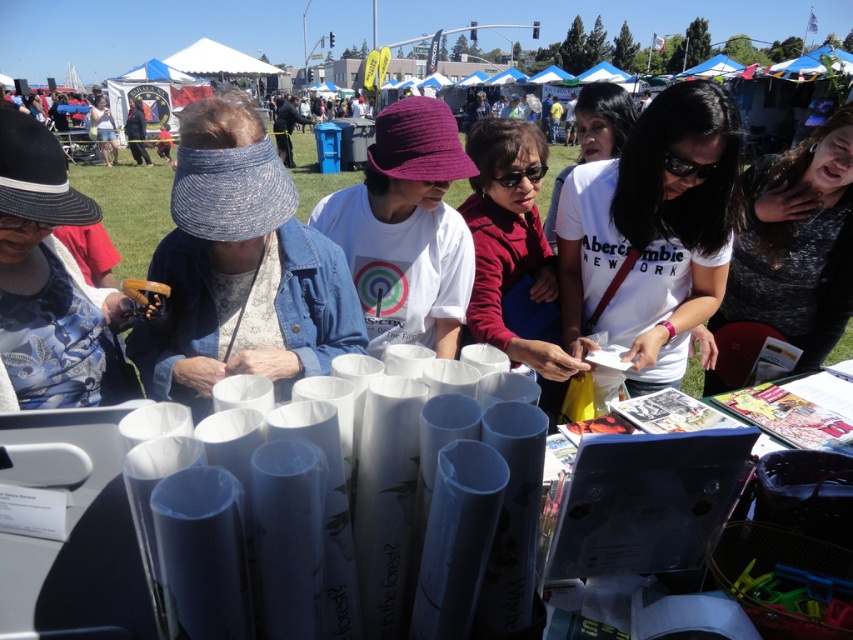
You are standing at the center of the table at the community fair. There are two points marked on the table surface. The first point is at coordinates point (395, 323) and the second point is at point (532, 323). If you want to place a small decoration closer to the camera, which point should you choose?

You should choose point (395, 323) because it is closer to the camera than point (532, 323).